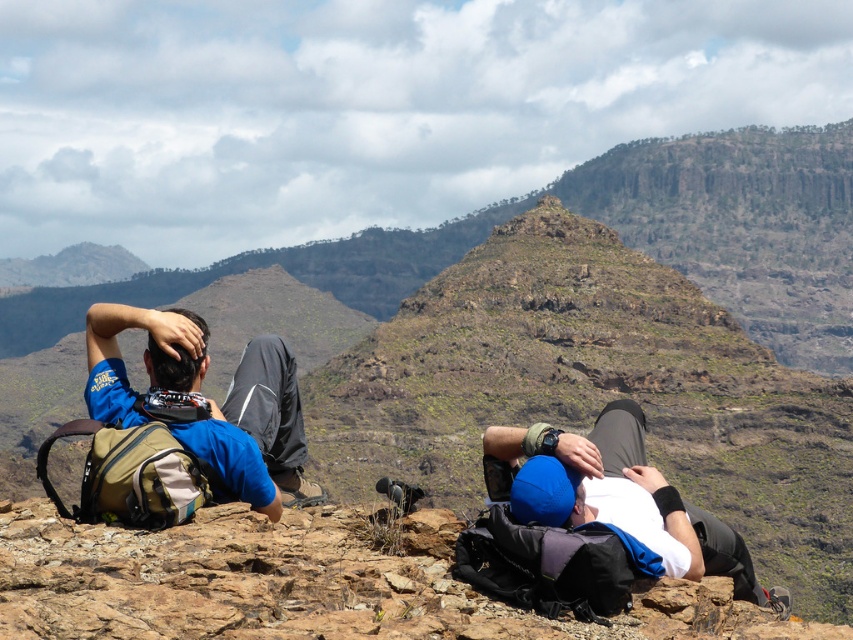
Is blue fabric cap at center taller than matte blue shirt at left?

No.

Who is more distant from viewer, (622,419) or (93,326)?

Positioned behind is point (622,419).

Between point (665, 541) and point (125, 328), which one is positioned in front?

Positioned in front is point (665, 541).

The width and height of the screenshot is (853, 640). Find the location of `blue fabric cap at center`. blue fabric cap at center is located at coordinates (618, 497).